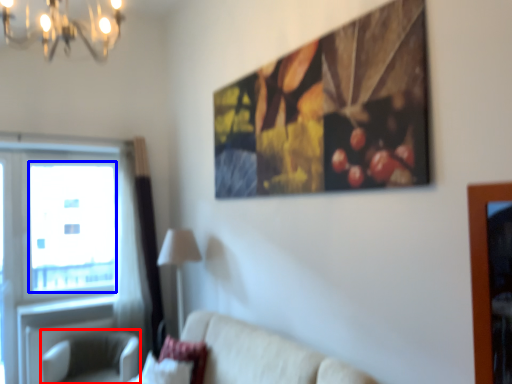
Question: Which point is further to the camera, swivel chair (highlighted by a red box) or window screen (highlighted by a blue box)?

Choices:
 (A) swivel chair
 (B) window screen

Answer: (B)